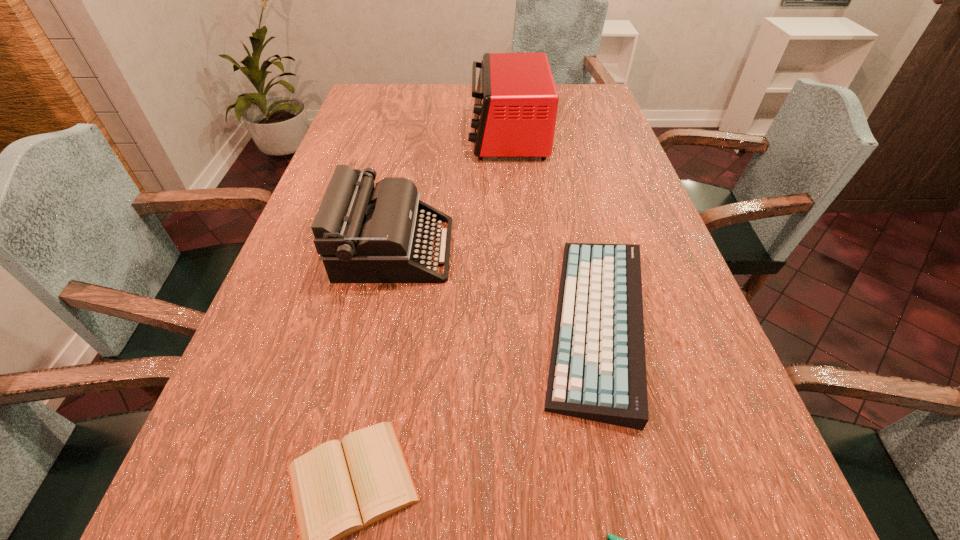
Find the location of a particular element. object located at the left edge is located at coordinates (365, 233).

In order to click on object that is at the right edge in this screenshot , I will do `click(597, 372)`.

You are a GUI agent. You are given a task and a screenshot of the screen. Output one action in this format:
    pyautogui.click(x=<x>, y=<y>)
    Task: Click on the free region at the far edge
    This screenshot has height=540, width=960.
    Given the screenshot: What is the action you would take?
    pyautogui.click(x=414, y=110)

Find the location of a particular element. The width and height of the screenshot is (960, 540). free space at the left edge is located at coordinates (184, 506).

This screenshot has height=540, width=960. In the image, there is a desktop. In order to click on vacant space at the right edge in this screenshot , I will do `click(649, 369)`.

At what (x,y) coordinates should I click in order to perform the action: click on vacant space at the far left corner of the desktop. Please return your answer as a coordinate pair (x, y). This screenshot has height=540, width=960. Looking at the image, I should click on (376, 99).

In the image, there is a desktop. At what (x,y) coordinates should I click in order to perform the action: click on vacant area at the far right corner. Please return your answer as a coordinate pair (x, y). This screenshot has height=540, width=960. Looking at the image, I should click on (568, 87).

Identify the location of free space that is in between the second tallest object and the tallest object. (451, 192).

Where is `free space that is in between the toaster oven and the computer keyboard`? The image size is (960, 540). free space that is in between the toaster oven and the computer keyboard is located at coordinates (552, 229).

The height and width of the screenshot is (540, 960). Find the location of `empty location between the third shortest object and the toaster oven`. empty location between the third shortest object and the toaster oven is located at coordinates (552, 229).